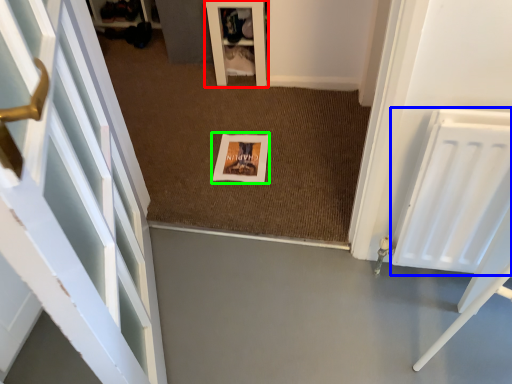
Question: Considering the real-world distances, which object is farthest from furniture (highlighted by a red box)? radiator (highlighted by a blue box) or picture frame (highlighted by a green box)?

Choices:
 (A) radiator
 (B) picture frame

Answer: (A)